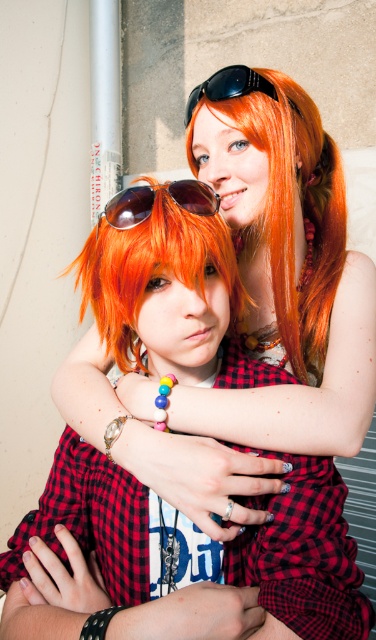
Question: Is orange matte wig at center further to the viewer compared to black plastic goggles at upper center?

Choices:
 (A) yes
 (B) no

Answer: (B)

Question: Which point is closer to the camera?

Choices:
 (A) orange matte wig at center
 (B) multicolored beaded bracelet at upper center
 (C) orange glossy hair at upper center
 (D) black plastic goggles at upper center

Answer: (A)

Question: Is matte red plaid shirt at center to the left of black plastic goggles at upper center from the viewer's perspective?

Choices:
 (A) yes
 (B) no

Answer: (A)

Question: Among these points, which one is nearest to the camera?

Choices:
 (A) (134, 188)
 (B) (274, 307)
 (C) (194, 88)

Answer: (A)

Question: Where is orange matte wig at center located in relation to matte red plaid shirt at center in the image?

Choices:
 (A) right
 (B) left

Answer: (A)

Question: Based on their relative distances, which object is nearer to the matte red plaid shirt at center?

Choices:
 (A) sunglasses at center
 (B) black plastic goggles at upper center
 (C) multicolored beaded bracelet at upper center

Answer: (C)